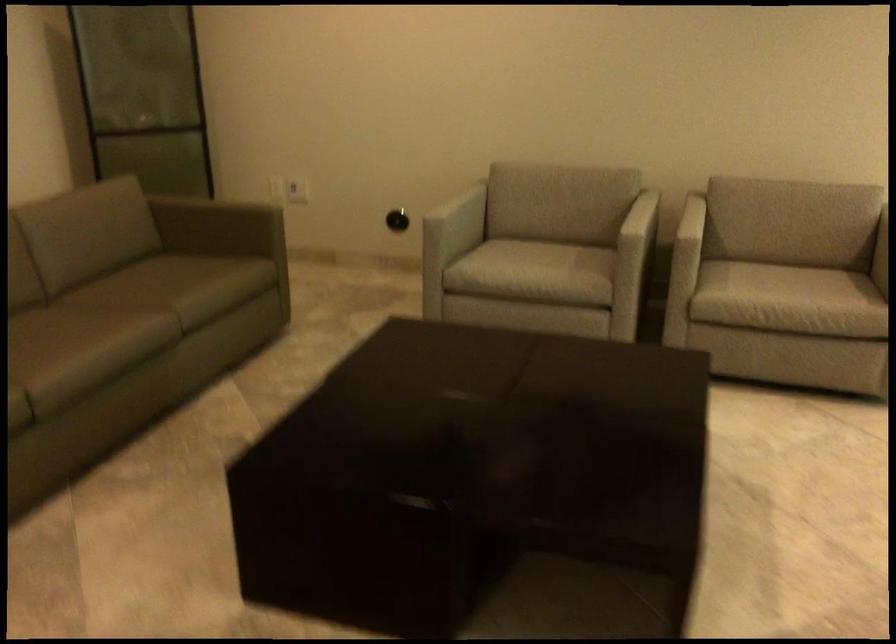
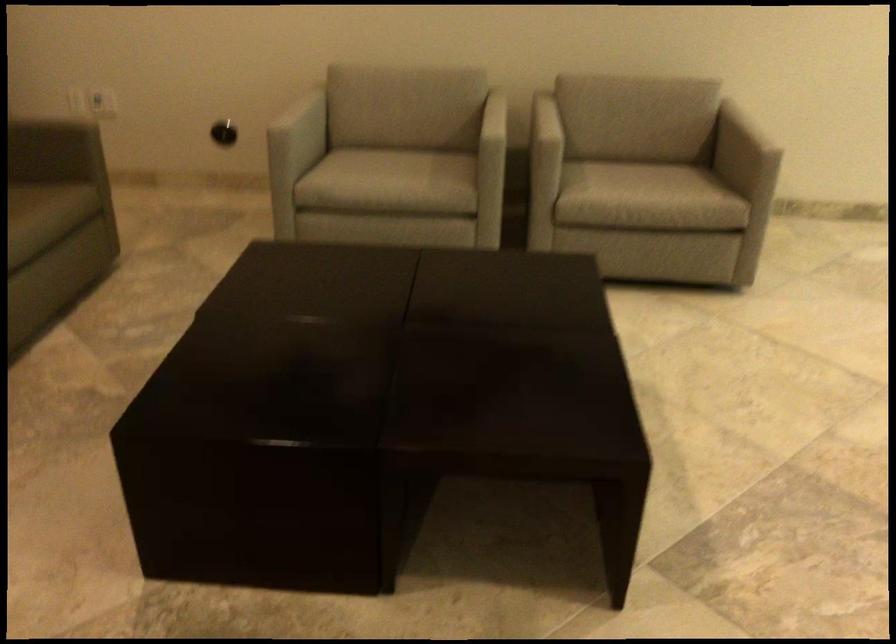
Find the pixel in the second image that matches point 530,265 in the first image.

(390, 176)